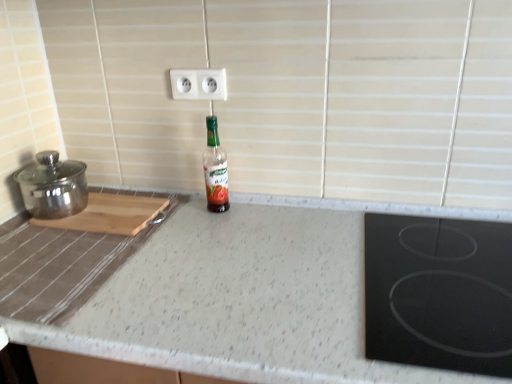
The height and width of the screenshot is (384, 512). Identify the location of spots to the right of green glass bottle at center. (270, 213).